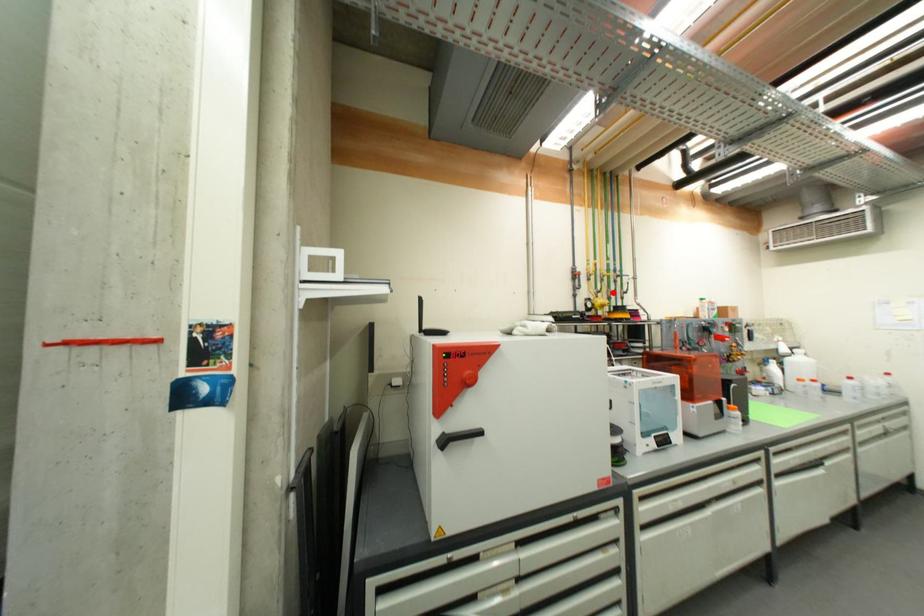
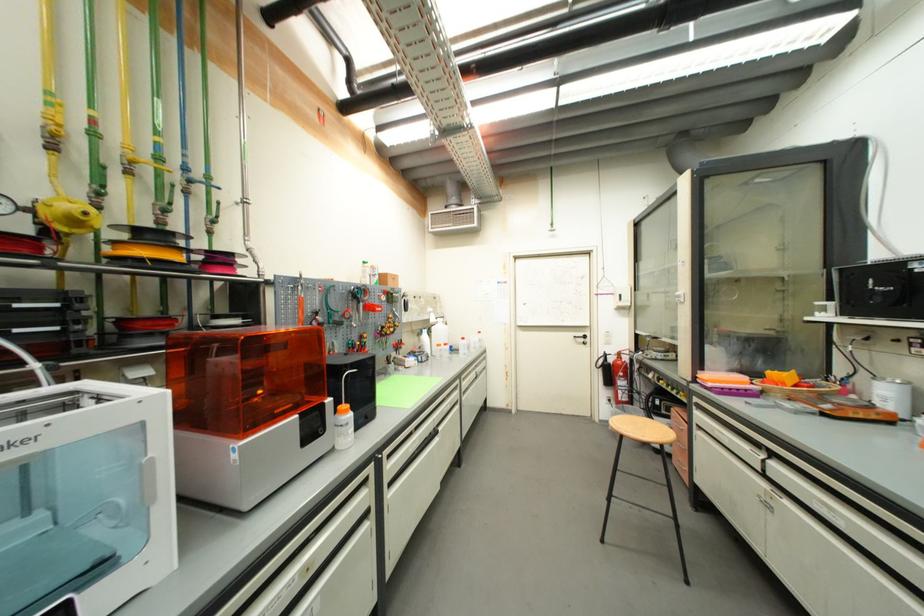
Locate, in the second image, the point that corresponds to the highlighted location in the first image.

(160, 207)